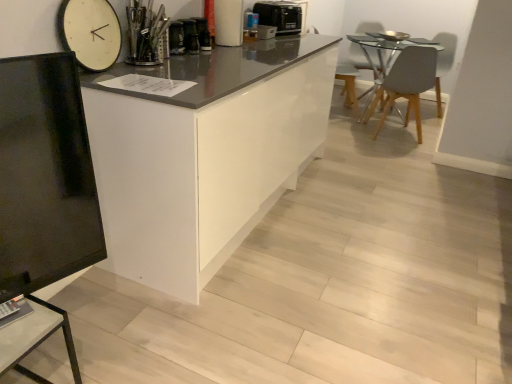
This screenshot has height=384, width=512. Find the location of `vacant area located to the right-hand side of white glossy cabinet at center`. vacant area located to the right-hand side of white glossy cabinet at center is located at coordinates (359, 206).